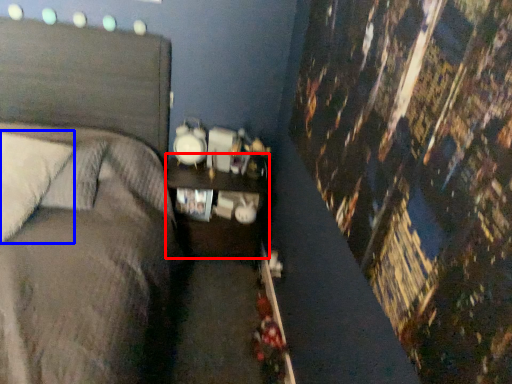
Question: Among these objects, which one is farthest to the camera, nightstand (highlighted by a red box) or pillow (highlighted by a blue box)?

Choices:
 (A) nightstand
 (B) pillow

Answer: (A)